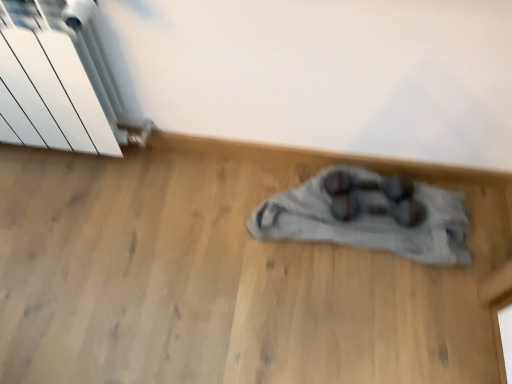
Identify the location of vacant space situated on the left part of shiny black dumbbells at center. This screenshot has height=384, width=512. (316, 215).